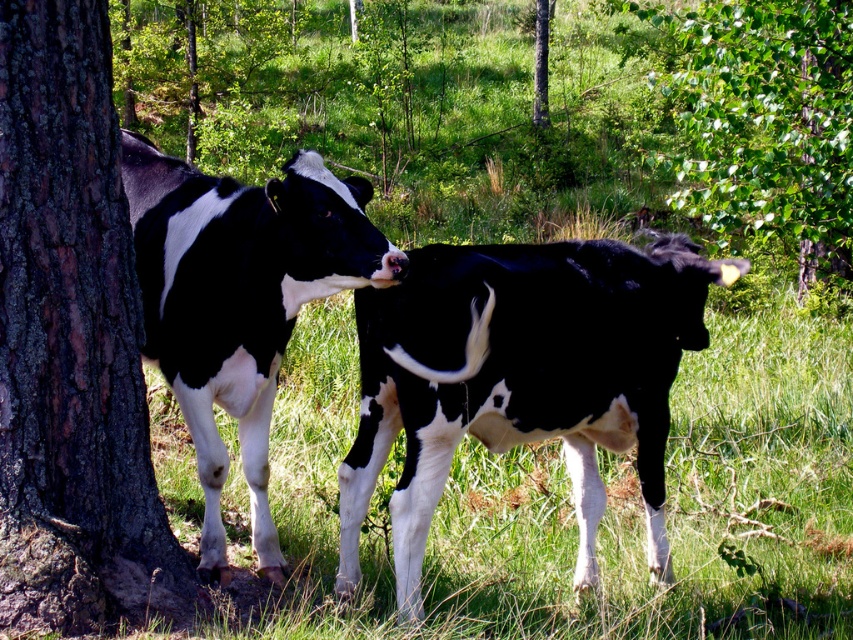
Question: Can you confirm if black and white fur at center is wider than green leafy tree at upper right?

Choices:
 (A) yes
 (B) no

Answer: (A)

Question: Which of the following is the farthest from the observer?

Choices:
 (A) (666, 387)
 (B) (721, 189)
 (C) (200, 483)
 (D) (138, 548)

Answer: (B)

Question: Which point is closer to the camera taking this photo?

Choices:
 (A) (575, 364)
 (B) (77, 188)
 (C) (735, 99)

Answer: (B)

Question: Does black and white spotted cow at left appear on the right side of green leafy tree at upper right?

Choices:
 (A) yes
 (B) no

Answer: (B)

Question: Where is brown rough tree trunk at left located in relation to green leafy tree at upper right in the image?

Choices:
 (A) left
 (B) right

Answer: (A)

Question: Which object is closer to the camera taking this photo?

Choices:
 (A) black and white fur at center
 (B) brown rough tree trunk at left

Answer: (B)